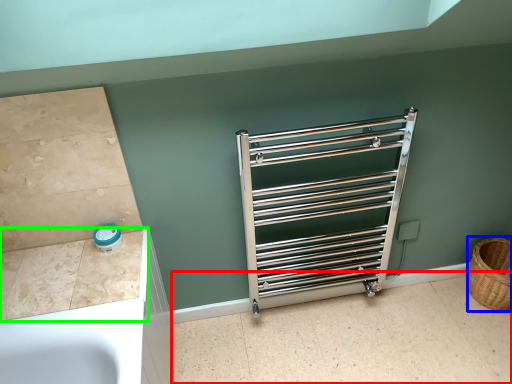
Question: Which object is positioned closest to tile (highlighted by a red box)? Select from basket (highlighted by a blue box) and counter top (highlighted by a green box).

Choices:
 (A) basket
 (B) counter top

Answer: (A)